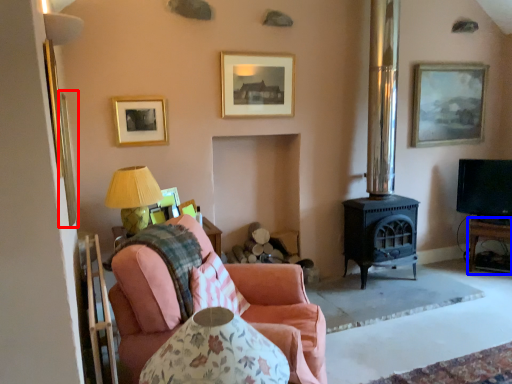
Question: Which object is closer to the camera taking this photo, picture frame (highlighted by a red box) or table (highlighted by a blue box)?

Choices:
 (A) picture frame
 (B) table

Answer: (A)